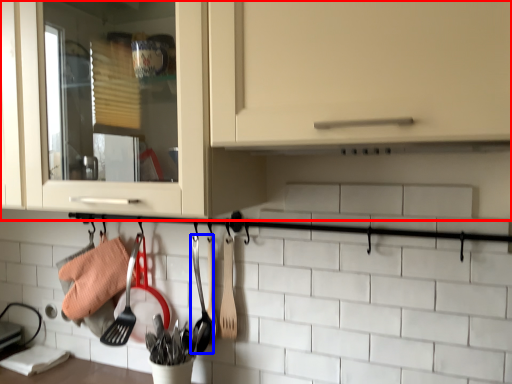
Question: Which object appears closest to the camera in this image, cabinetry (highlighted by a red box) or silverware (highlighted by a blue box)?

Choices:
 (A) cabinetry
 (B) silverware

Answer: (A)